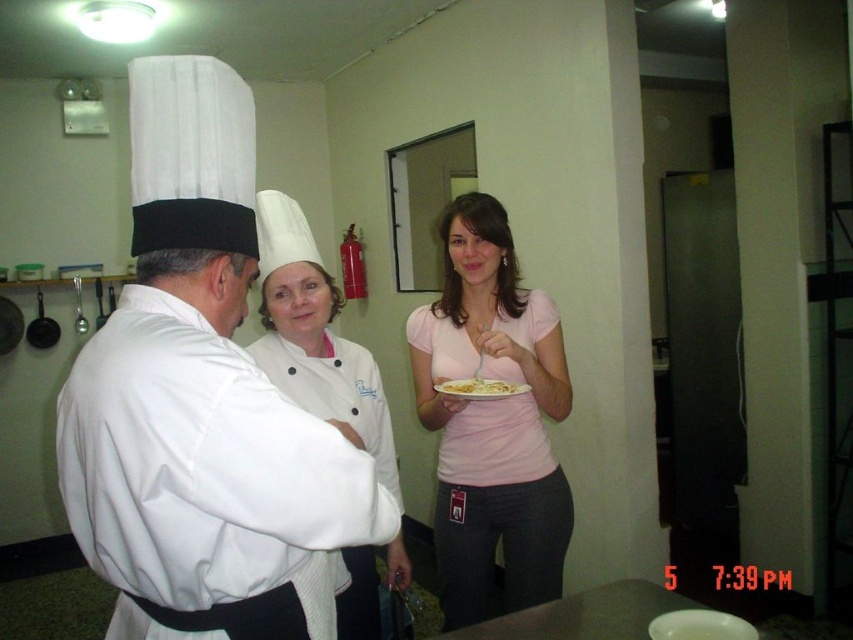
Question: Is the position of pink matte shirt at center less distant than that of white matte chef hat at center?

Choices:
 (A) no
 (B) yes

Answer: (A)

Question: Which point appears closest to the camera in this image?

Choices:
 (A) (265, 298)
 (B) (491, 605)

Answer: (A)

Question: Among these points, which one is farthest from the camera?

Choices:
 (A) (474, 396)
 (B) (233, 310)
 (C) (302, 385)

Answer: (A)

Question: Estimate the real-world distances between objects in this image. Which object is closer to the pink matte shirt at center?

Choices:
 (A) yellow matte pasta at center
 (B) white matte chef hat at center
 (C) white matte chef hat at left

Answer: (A)

Question: Does pink matte shirt at center have a lesser width compared to yellow matte pasta at center?

Choices:
 (A) no
 (B) yes

Answer: (A)

Question: Does pink matte shirt at center appear on the left side of white matte chef hat at center?

Choices:
 (A) no
 (B) yes

Answer: (A)